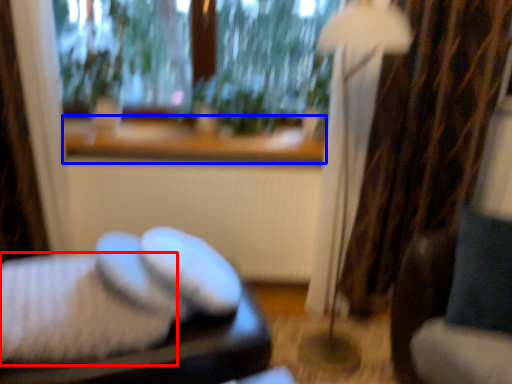
Question: Which object is closer to the camera taking this photo, sheet (highlighted by a red box) or window sill (highlighted by a blue box)?

Choices:
 (A) sheet
 (B) window sill

Answer: (A)